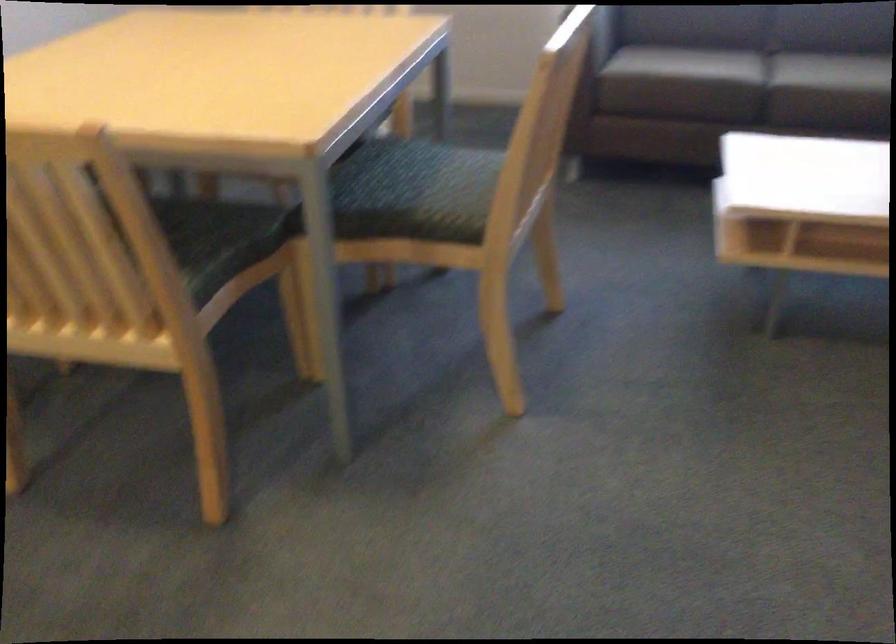
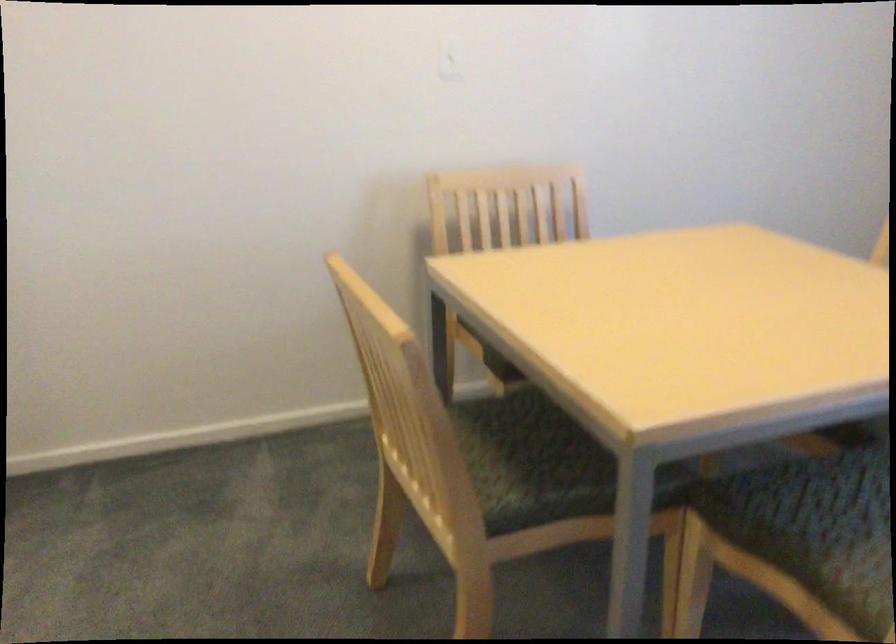
Locate, in the second image, the point that corresponds to pixel 397 205 in the first image.

(798, 541)